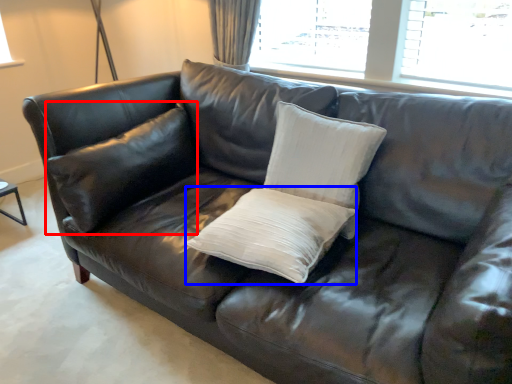
Question: Which object appears closest to the camera in this image, pillow (highlighted by a red box) or pillow (highlighted by a blue box)?

Choices:
 (A) pillow
 (B) pillow

Answer: (B)